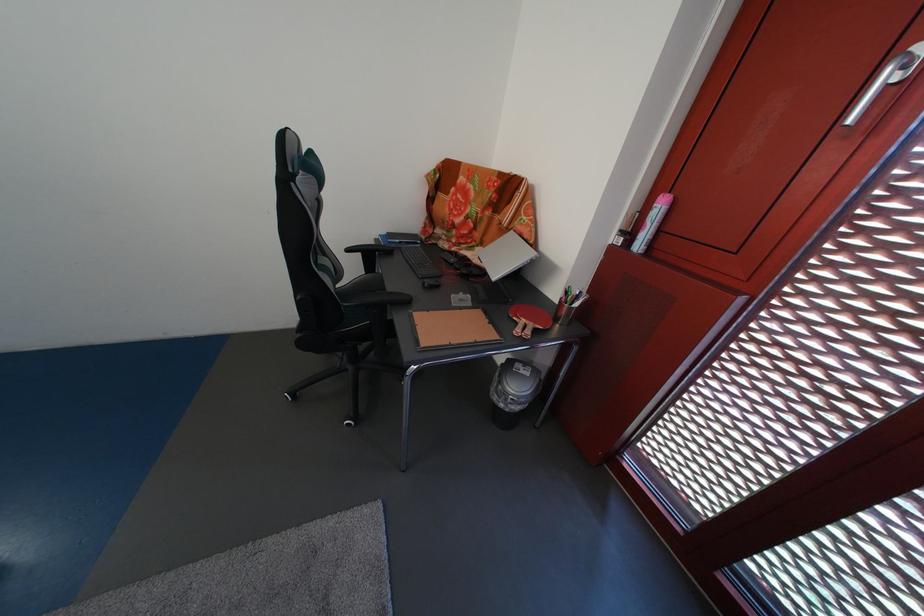
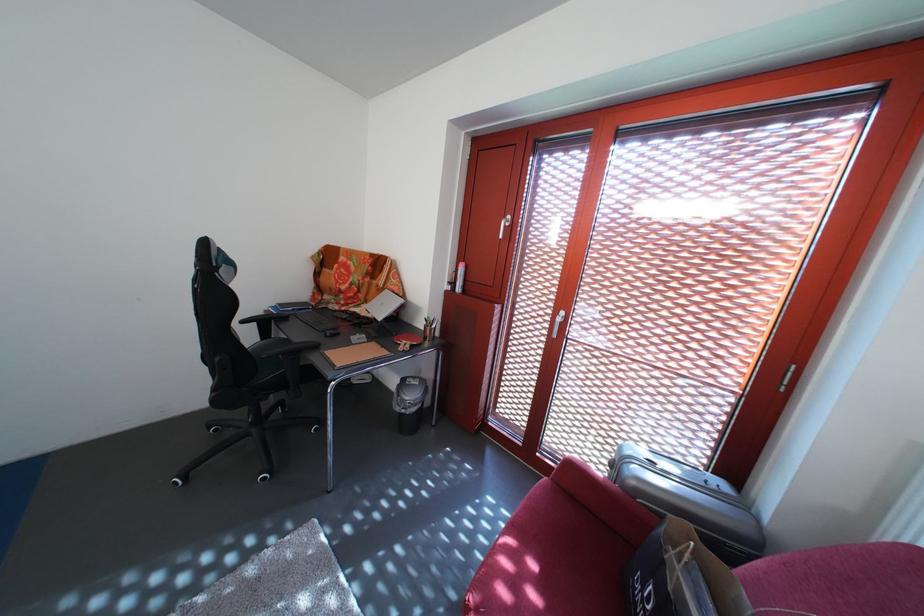
Where in the second image is the point corresponding to pixel 505 405 from the first image?

(408, 416)